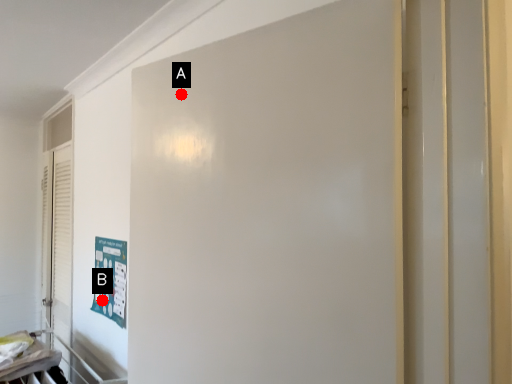
Question: Two points are circled on the image, labeled by A and B beside each circle. Which of the following is the farthest from the observer?

Choices:
 (A) A is further
 (B) B is further

Answer: (B)